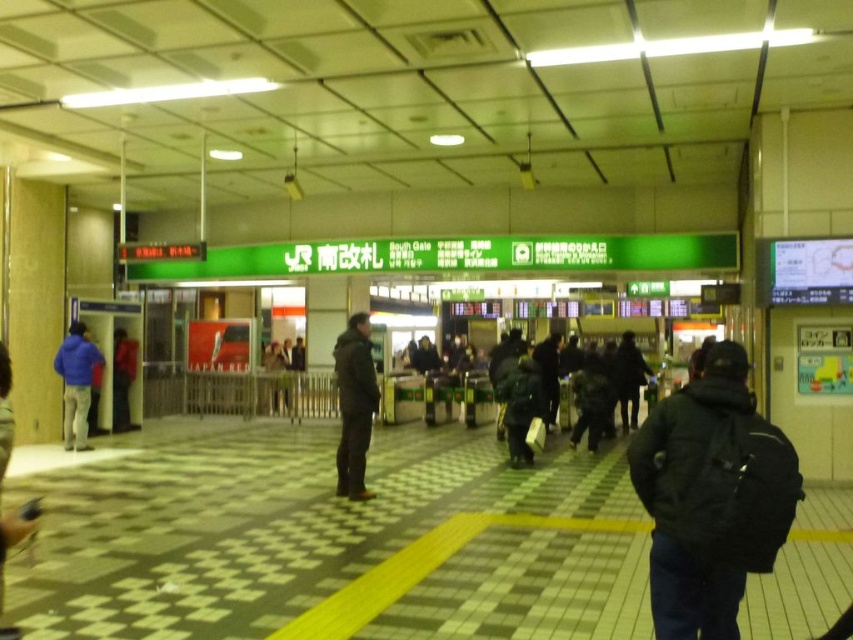
Can you confirm if black matte jacket at center is positioned below matte black backpack at left?

Actually, black matte jacket at center is above matte black backpack at left.

Does black matte jacket at center have a smaller size compared to matte black backpack at left?

No, black matte jacket at center is not smaller than matte black backpack at left.

Is point (364, 404) positioned in front of point (114, 340)?

That is True.

At what (x,y) coordinates should I click in order to perform the action: click on black matte jacket at center. Please return your answer as a coordinate pair (x, y). The image size is (853, 640). Looking at the image, I should click on (354, 404).

Is point (635, 452) positioned after point (1, 529)?

That is False.

Can you confirm if black matte jacket at right is shorter than dark blue jacket at left?

Yes, black matte jacket at right is shorter than dark blue jacket at left.

Where is `black matte jacket at right`? The width and height of the screenshot is (853, 640). black matte jacket at right is located at coordinates [x=711, y=497].

Between black matte jacket at center and blue fleece jacket at left, which one is positioned higher?

black matte jacket at center is above.

What do you see at coordinates (354, 404) in the screenshot?
I see `black matte jacket at center` at bounding box center [354, 404].

Does point (351, 403) come farther from viewer compared to point (73, 432)?

That is False.

Locate an element on the screen. black matte jacket at center is located at coordinates (354, 404).